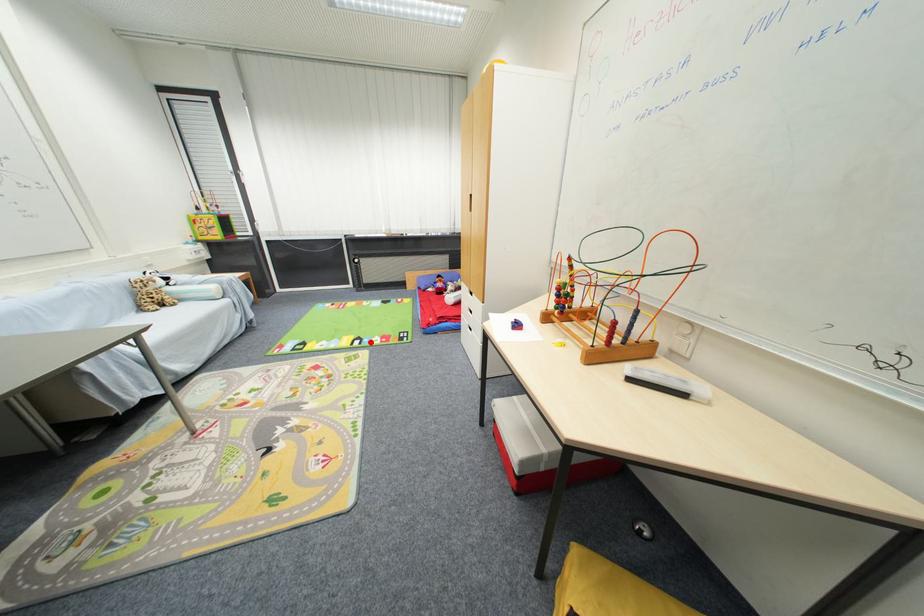
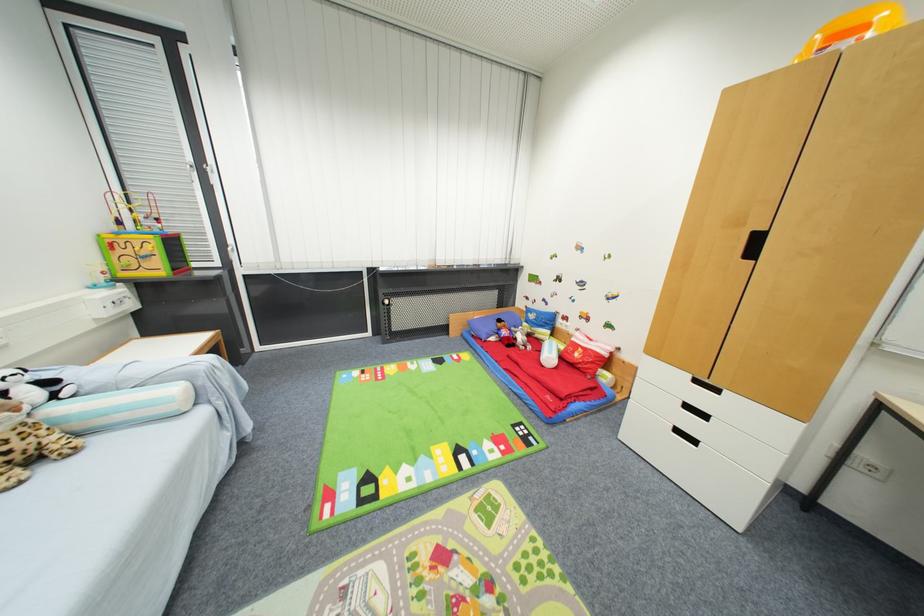
Find the pixel in the second image that matches the highlighted location in the first image.

(479, 455)